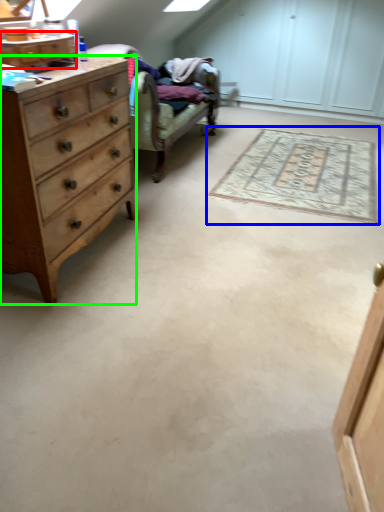
Question: Estimate the real-world distances between objects in this image. Which object is closer to cabinetry (highlighted by a red box), mat (highlighted by a blue box) or chest of drawers (highlighted by a green box)?

Choices:
 (A) mat
 (B) chest of drawers

Answer: (B)